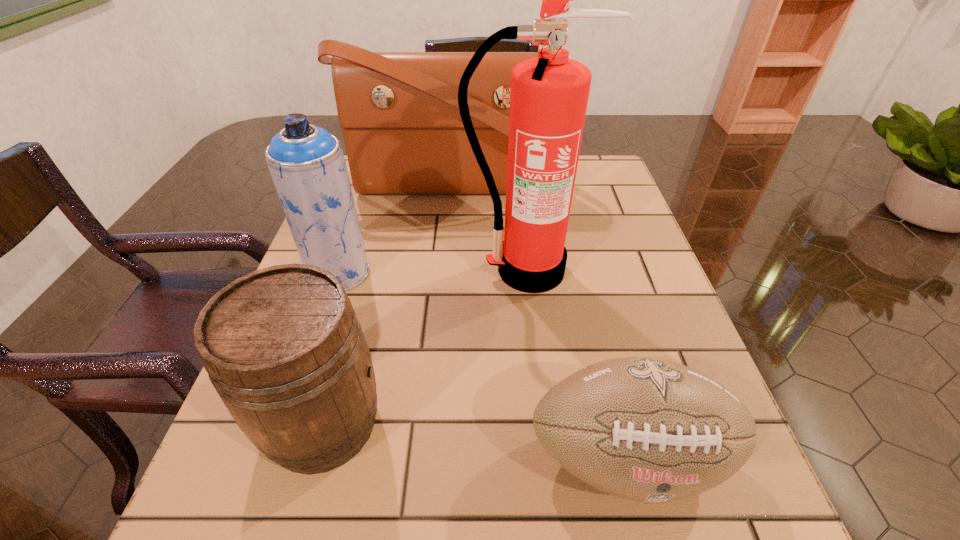
Locate an element on the screen. The image size is (960, 540). free space between the aerosol can and the shortest object is located at coordinates (483, 365).

Locate an element on the screen. The width and height of the screenshot is (960, 540). free space that is in between the tallest object and the fourth tallest object is located at coordinates (425, 347).

Select which object is the third closest to the aerosol can. Please provide its 2D coordinates. Your answer should be formatted as a tuple, i.e. [(x, y)], where the tuple contains the x and y coordinates of a point satisfying the conditions above.

[(549, 95)]

Locate which object ranks second in proximity to the satchel. Please provide its 2D coordinates. Your answer should be formatted as a tuple, i.e. [(x, y)], where the tuple contains the x and y coordinates of a point satisfying the conditions above.

[(307, 165)]

Image resolution: width=960 pixels, height=540 pixels. What are the coordinates of `free space that satisfies the following two spatial constraints: 1. with the nozzle aimed from the fire extinguisher; 2. on the side of the cider near the bung hole` in the screenshot? It's located at (544, 423).

What are the coordinates of `vacant position in the image that satisfies the following two spatial constraints: 1. on the front flap of the farthest object; 2. on the side of the cider near the bung hole` in the screenshot? It's located at (435, 423).

Identify the location of free space in the image that satisfies the following two spatial constraints: 1. on the front flap of the satchel; 2. on the side of the cider near the bung hole. (435, 423).